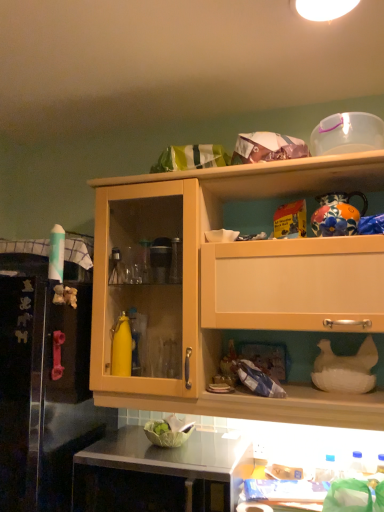
What is the approximate width of wooden cabinet at upper center?

wooden cabinet at upper center is 15.20 inches wide.

Describe the element at coordinates (160, 472) in the screenshot. Image resolution: width=384 pixels, height=512 pixels. I see `black glossy countertop at lower center` at that location.

Where is `wooden cabinet at upper center`? Image resolution: width=384 pixels, height=512 pixels. wooden cabinet at upper center is located at coordinates (237, 286).

Between point (340, 11) and point (321, 151), which one is positioned behind?

The point (321, 151) is farther from the camera.

Is white glossy light fixture at upper center smaller than transparent plastic container at upper right, which is counted as the 1th appliance, starting from the top?

Yes, white glossy light fixture at upper center is smaller than transparent plastic container at upper right, which is counted as the 1th appliance, starting from the top.

Image resolution: width=384 pixels, height=512 pixels. What are the coordinates of `lighting positioned vertically above the transparent plastic container at upper right, which appears as the second appliance when ordered from the bottom (from a real-world perspective)` in the screenshot? It's located at (324, 9).

Relative to white matte chicken at lower right, which is the 1th appliance from bottom to top, is rubber pink handle at left in front or behind?

Clearly, rubber pink handle at left is in front of white matte chicken at lower right, which is the 1th appliance from bottom to top.

Which is correct: rubber pink handle at left is inside white matte chicken at lower right, which is the 1th appliance from bottom to top, or outside of it?

rubber pink handle at left lies outside white matte chicken at lower right, which is the 1th appliance from bottom to top.

Considering the sizes of objects rubber pink handle at left and white matte chicken at lower right, the second appliance when ordered from top to bottom, in the image provided, who is thinner, rubber pink handle at left or white matte chicken at lower right, the second appliance when ordered from top to bottom,?

Thinner between the two is white matte chicken at lower right, the second appliance when ordered from top to bottom.

Find the location of a particular element. the 1st appliance above the rubber pink handle at left (from the image's perspective) is located at coordinates (345, 369).

From a real-world perspective, which is physically above, white matte chicken at lower right, which is the 1th appliance from bottom to top, or rubber pink handle at left?

In real-world perspective, white matte chicken at lower right, which is the 1th appliance from bottom to top, is above.

How different are the orientations of white matte chicken at lower right, which is the 1th appliance from bottom to top, and rubber pink handle at left in degrees?

They differ by 8.24e-05 degrees in their facing directions.

Considering the positions of point (330, 387) and point (23, 333), is point (330, 387) closer or farther from the camera than point (23, 333)?

Clearly, point (330, 387) is more distant from the camera than point (23, 333).

The height and width of the screenshot is (512, 384). Find the location of `appliance that is the 1st object located above the black glossy countertop at lower center (from the image's perspective)`. appliance that is the 1st object located above the black glossy countertop at lower center (from the image's perspective) is located at coordinates (345, 369).

From a real-world perspective, is white matte chicken at lower right, which is the 1th appliance from bottom to top, below black glossy countertop at lower center?

No, from a real-world perspective, white matte chicken at lower right, which is the 1th appliance from bottom to top, is not below black glossy countertop at lower center.

From the image's perspective, who appears lower, white matte chicken at lower right, the second appliance when ordered from top to bottom, or black glossy countertop at lower center?

From the image's view, black glossy countertop at lower center is below.

Considering the positions of points (368, 140) and (3, 481), is point (368, 140) farther from camera compared to point (3, 481)?

Yes, point (368, 140) is behind point (3, 481).

Find the location of a particular element. The height and width of the screenshot is (512, 384). leftover on the left side of transparent plastic container at upper right, which is counted as the 1th appliance, starting from the top is located at coordinates (43, 386).

From the image's perspective, which object appears higher, transparent plastic container at upper right, which appears as the second appliance when ordered from the bottom, or rubber pink handle at left?

transparent plastic container at upper right, which appears as the second appliance when ordered from the bottom, is shown above in the image.

Identify the location of appliance that is the 1st one when counting rightward from the white glossy light fixture at upper center. The image size is (384, 512). (347, 134).

Considering the positions of point (312, 142) and point (341, 15), is point (312, 142) closer or farther from the camera than point (341, 15)?

Point (312, 142) is farther from the camera than point (341, 15).

Does transparent plastic container at upper right, which is counted as the 1th appliance, starting from the top, have a greater width compared to white glossy light fixture at upper center?

In fact, transparent plastic container at upper right, which is counted as the 1th appliance, starting from the top, might be narrower than white glossy light fixture at upper center.

Would you say transparent plastic container at upper right, which is counted as the 1th appliance, starting from the top, is outside white glossy light fixture at upper center?

That's correct, transparent plastic container at upper right, which is counted as the 1th appliance, starting from the top, is outside of white glossy light fixture at upper center.

In the image, is rubber pink handle at left on the left side or the right side of wooden cabinet at upper center?

Based on their positions, rubber pink handle at left is located to the left of wooden cabinet at upper center.

Is wooden cabinet at upper center a part of rubber pink handle at left?

No, wooden cabinet at upper center is located outside of rubber pink handle at left.

Is rubber pink handle at left oriented towards wooden cabinet at upper center?

No, rubber pink handle at left is not aimed at wooden cabinet at upper center.

Is rubber pink handle at left taller or shorter than wooden cabinet at upper center?

In the image, rubber pink handle at left appears to be taller than wooden cabinet at upper center.

Locate an element on the screen. The width and height of the screenshot is (384, 512). lighting on the left side of transparent plastic container at upper right, which is counted as the 1th appliance, starting from the top is located at coordinates (324, 9).

At what (x,y) coordinates should I click in order to perform the action: click on leftover in front of the white matte chicken at lower right, the second appliance when ordered from top to bottom. Please return your answer as a coordinate pair (x, y). Looking at the image, I should click on (43, 386).

Considering their positions, is black glossy countertop at lower center positioned further to white glossy light fixture at upper center than white matte chicken at lower right, which is the 1th appliance from bottom to top?

Among the two, black glossy countertop at lower center is located further to white glossy light fixture at upper center.

Looking at this image, which object lies nearer to the anchor point rubber pink handle at left, black glossy countertop at lower center or wooden cabinet at upper center?

black glossy countertop at lower center is positioned closer to the anchor rubber pink handle at left.

Estimate the real-world distances between objects in this image. Which object is closer to wooden cabinet at upper center, rubber pink handle at left or black glossy countertop at lower center?

The object closer to wooden cabinet at upper center is rubber pink handle at left.

Considering their positions, is wooden cabinet at upper center positioned further to rubber pink handle at left than white matte chicken at lower right, which is the 1th appliance from bottom to top?

white matte chicken at lower right, which is the 1th appliance from bottom to top, is positioned further to the anchor rubber pink handle at left.

From the image, which object appears to be nearer to white glossy light fixture at upper center, black glossy countertop at lower center or rubber pink handle at left?

Among the two, rubber pink handle at left is located nearer to white glossy light fixture at upper center.

From the image, which object appears to be farther from transparent plastic container at upper right, which appears as the second appliance when ordered from the bottom, white glossy light fixture at upper center or black glossy countertop at lower center?

black glossy countertop at lower center is positioned further to the anchor transparent plastic container at upper right, which appears as the second appliance when ordered from the bottom.

When comparing their distances from black glossy countertop at lower center, does white matte chicken at lower right, which is the 1th appliance from bottom to top, or white glossy light fixture at upper center seem further?

white glossy light fixture at upper center.

When comparing their distances from white matte chicken at lower right, which is the 1th appliance from bottom to top, does rubber pink handle at left or white glossy light fixture at upper center seem closer?

rubber pink handle at left.

The image size is (384, 512). Find the location of `leftover that lies between transparent plastic container at upper right, which appears as the second appliance when ordered from the bottom, and black glossy countertop at lower center from top to bottom`. leftover that lies between transparent plastic container at upper right, which appears as the second appliance when ordered from the bottom, and black glossy countertop at lower center from top to bottom is located at coordinates (43, 386).

This screenshot has width=384, height=512. Find the location of `cabinetry between rubber pink handle at left and transparent plastic container at upper right, which is counted as the 1th appliance, starting from the top, in the horizontal direction`. cabinetry between rubber pink handle at left and transparent plastic container at upper right, which is counted as the 1th appliance, starting from the top, in the horizontal direction is located at coordinates pos(237,286).

At what (x,y) coordinates should I click in order to perform the action: click on appliance between white glossy light fixture at upper center and white matte chicken at lower right, which is the 1th appliance from bottom to top, vertically. Please return your answer as a coordinate pair (x, y). Looking at the image, I should click on (347, 134).

This screenshot has height=512, width=384. I want to click on countertop situated between rubber pink handle at left and wooden cabinet at upper center from left to right, so click(x=160, y=472).